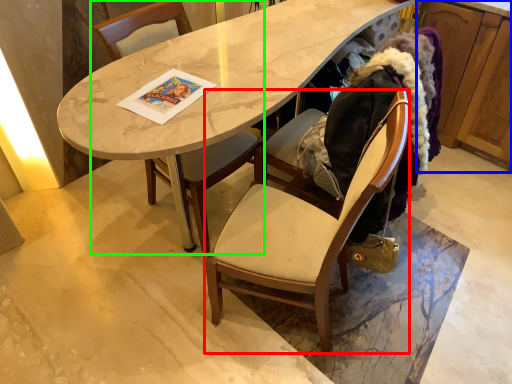
Question: Estimate the real-world distances between objects in this image. Which object is farther from chair (highlighted by a red box), cabinetry (highlighted by a blue box) or chair (highlighted by a green box)?

Choices:
 (A) cabinetry
 (B) chair

Answer: (A)